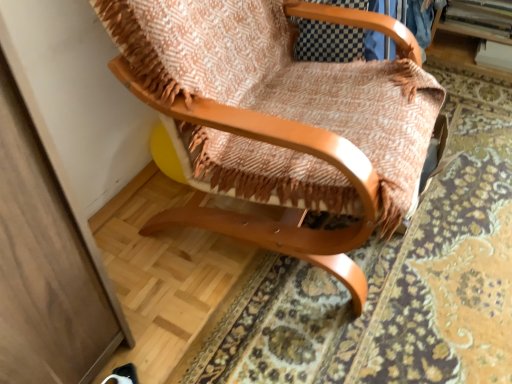
Question: From the image's perspective, is wooden chair at center located beneath woven fabric mat at center?

Choices:
 (A) no
 (B) yes

Answer: (A)

Question: Is wooden chair at center completely or partially outside of woven fabric mat at center?

Choices:
 (A) yes
 (B) no

Answer: (A)

Question: Considering the relative sizes of wooden chair at center and woven fabric mat at center in the image provided, is wooden chair at center taller than woven fabric mat at center?

Choices:
 (A) no
 (B) yes

Answer: (B)

Question: Is wooden chair at center bigger than woven fabric mat at center?

Choices:
 (A) no
 (B) yes

Answer: (B)

Question: Is wooden chair at center next to woven fabric mat at center?

Choices:
 (A) no
 (B) yes

Answer: (A)

Question: From the image's perspective, is wooden chair at center on woven fabric mat at center?

Choices:
 (A) no
 (B) yes

Answer: (B)

Question: Is woven fabric mat at center further to the viewer compared to wooden chair at center?

Choices:
 (A) no
 (B) yes

Answer: (B)

Question: Can wooden chair at center be found inside woven fabric mat at center?

Choices:
 (A) yes
 (B) no

Answer: (B)

Question: From a real-world perspective, is woven fabric mat at center over wooden chair at center?

Choices:
 (A) yes
 (B) no

Answer: (B)

Question: From the image's perspective, is woven fabric mat at center located above wooden chair at center?

Choices:
 (A) no
 (B) yes

Answer: (A)

Question: Is woven fabric mat at center oriented towards wooden chair at center?

Choices:
 (A) no
 (B) yes

Answer: (B)

Question: Can you confirm if woven fabric mat at center is thinner than wooden chair at center?

Choices:
 (A) yes
 (B) no

Answer: (B)

Question: Is point (258, 228) closer or farther from the camera than point (287, 259)?

Choices:
 (A) closer
 (B) farther

Answer: (A)